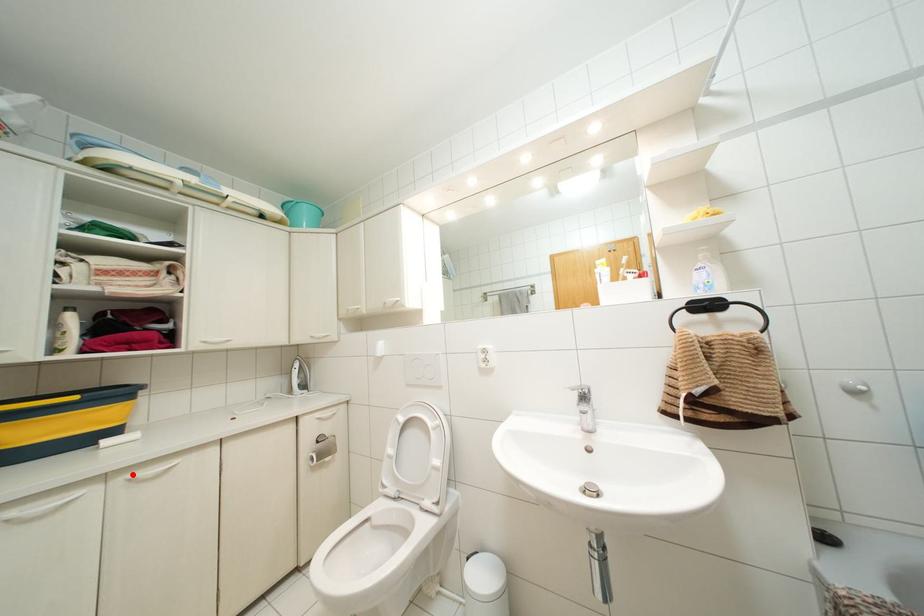
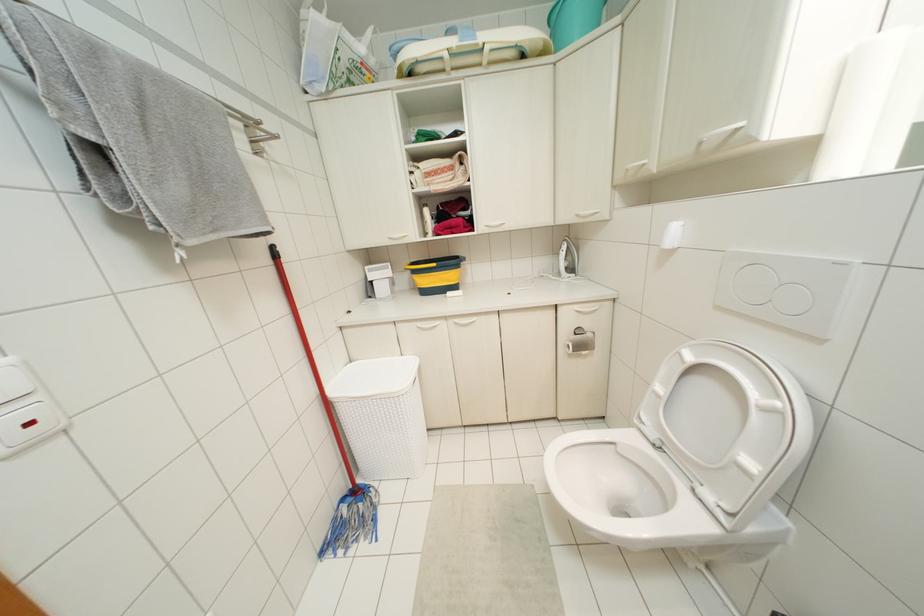
Where in the second image is the point corresponding to the highlighted location from the first image?

(456, 320)